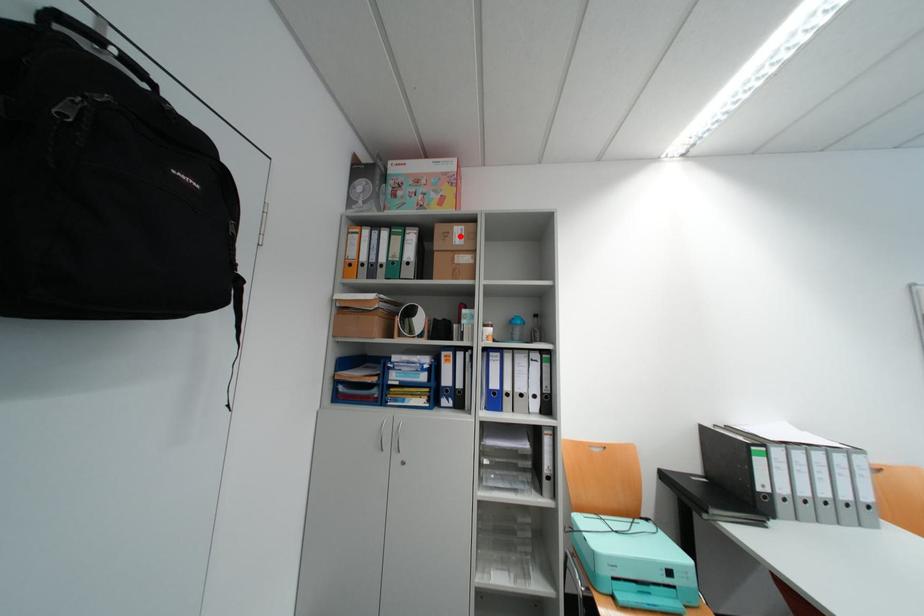
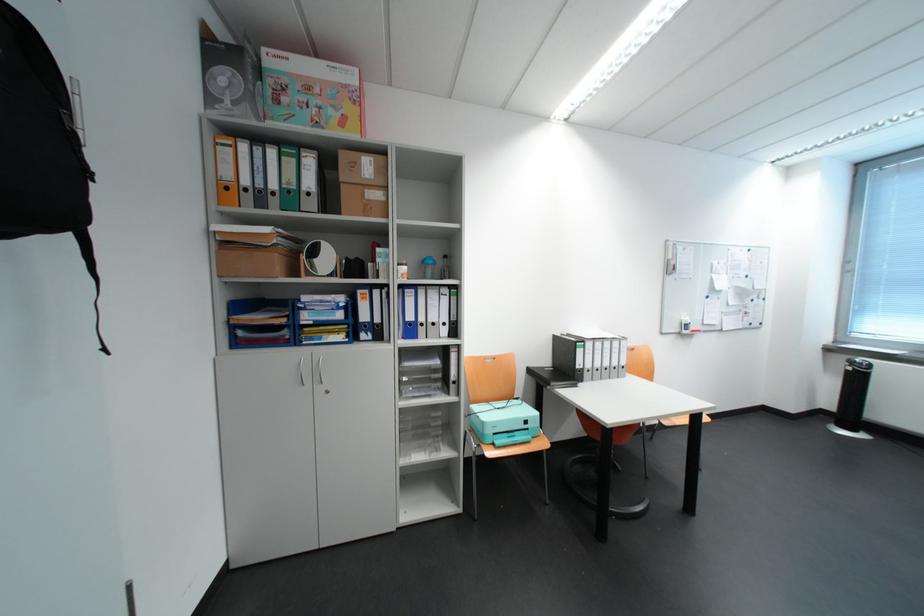
In the second image, find the point that corresponds to the highlighted location in the first image.

(368, 167)